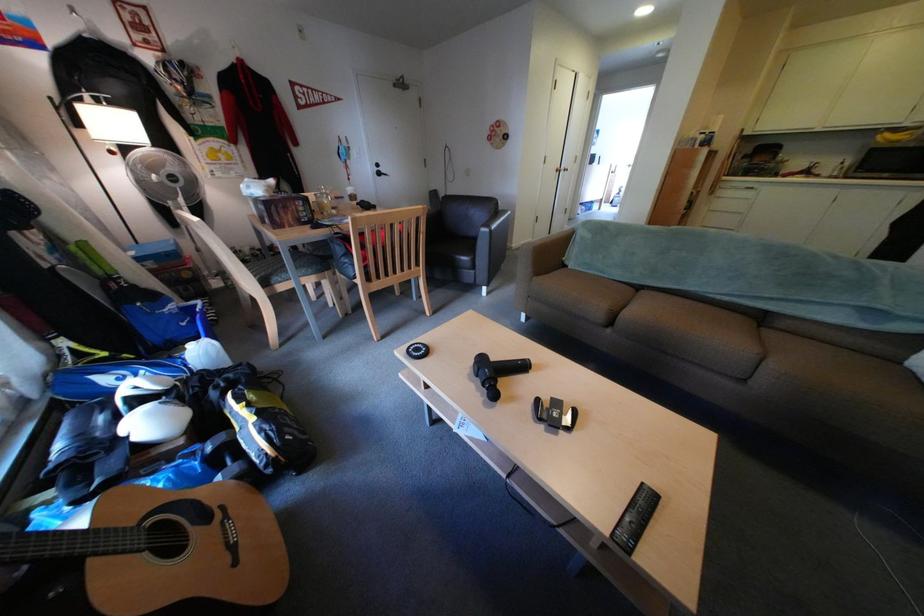
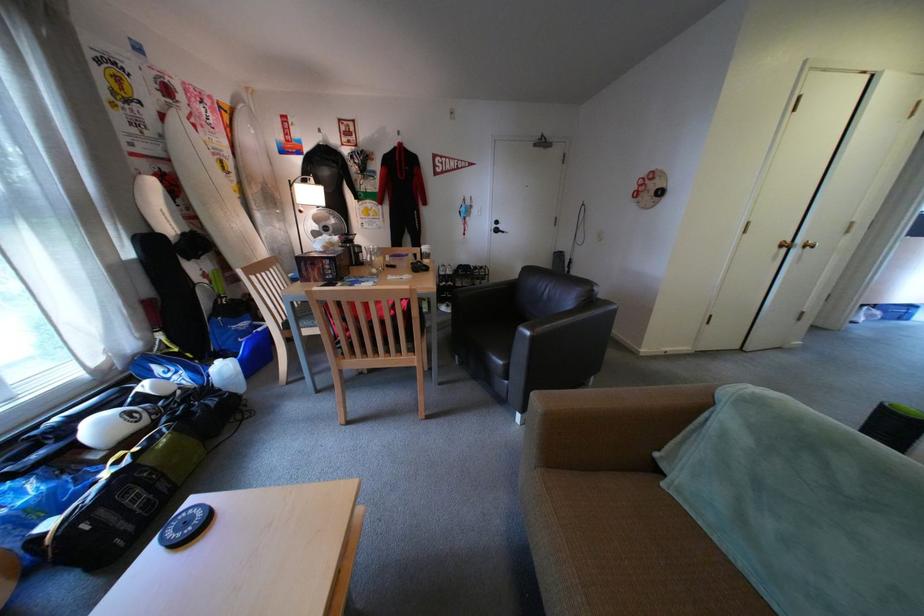
In the second image, find the point that corresponds to point 301,230 in the first image.

(325, 285)